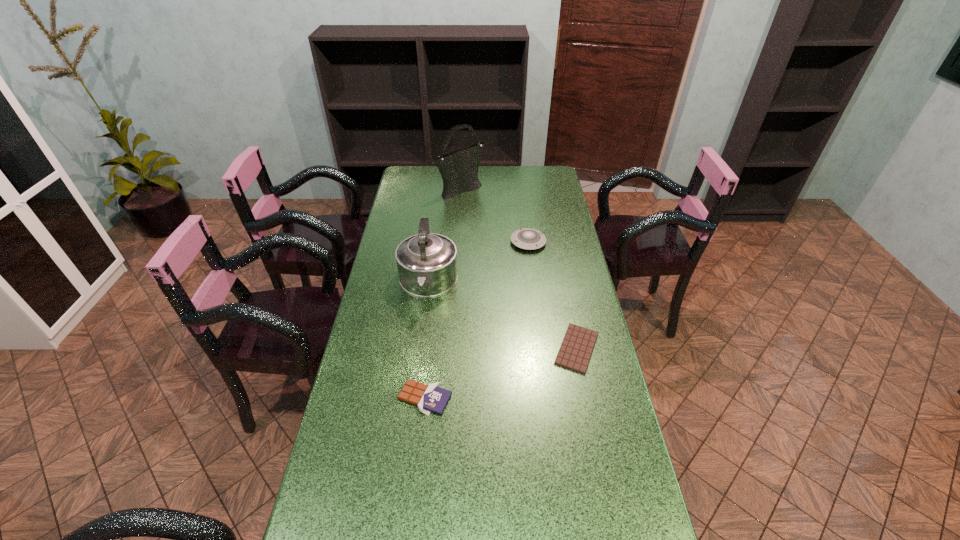
Locate an element on the screen. The image size is (960, 540). free space that satisfies the following two spatial constraints: 1. with the spout at the front of the third farthest object; 2. on the right side of the shorter chocolate bar is located at coordinates (420, 348).

Locate an element on the screen. vacant space that satisfies the following two spatial constraints: 1. on the back side of the taller chocolate bar; 2. on the left side of the second nearest object is located at coordinates (430, 348).

Locate an element on the screen. This screenshot has width=960, height=540. free point that satisfies the following two spatial constraints: 1. on the back side of the second farthest object; 2. on the right side of the second shortest object is located at coordinates (442, 242).